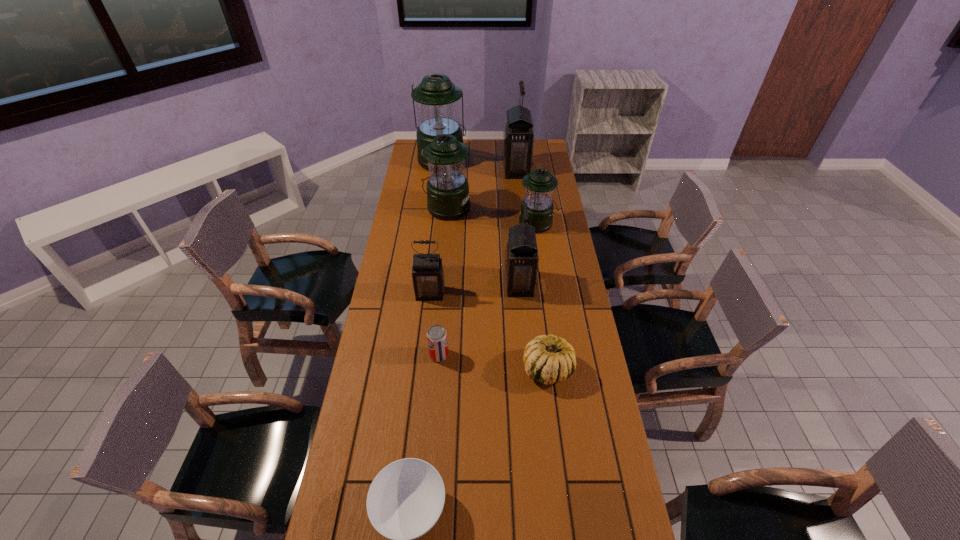
Locate an element on the screen. blank space that satisfies the following two spatial constraints: 1. on the front side of the gourd; 2. on the left side of the second smallest green lantern is located at coordinates [432, 369].

What are the coordinates of `free space that satisfies the following two spatial constraints: 1. on the back side of the rightmost green lantern; 2. on the front-facing side of the farthest gray lantern` in the screenshot? It's located at [529, 170].